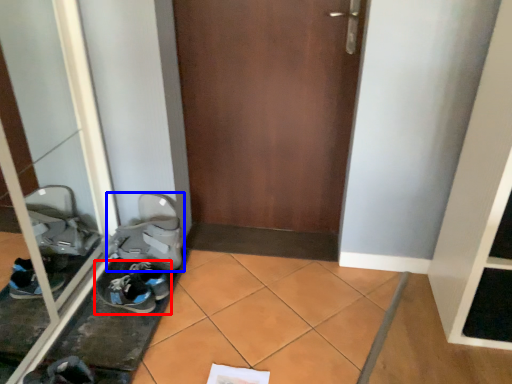
Question: Among these objects, which one is nearest to the camera, footwear (highlighted by a red box) or footwear (highlighted by a blue box)?

Choices:
 (A) footwear
 (B) footwear

Answer: (A)